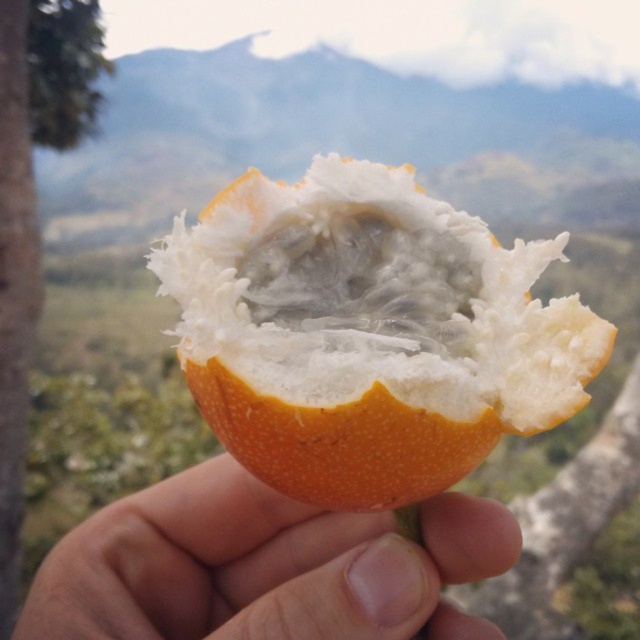
You are a photographer trying to capture the passion fruit in the image. You notice two points marked in the scene. Which point is closer to the camera, point (134, 532) or point (90, 124)?

Point (134, 532) is in front of point (90, 124), so it is closer to the camera.

You are an artist trying to sketch the scene. You need to decide which object to draw first based on their sizes. Which one should you start with, the orange skin at center or the green rough bark tree at left?

The orange skin at center is shorter than the green rough bark tree at left, so you should start with the orange skin at center since it is smaller and might be easier to sketch first.